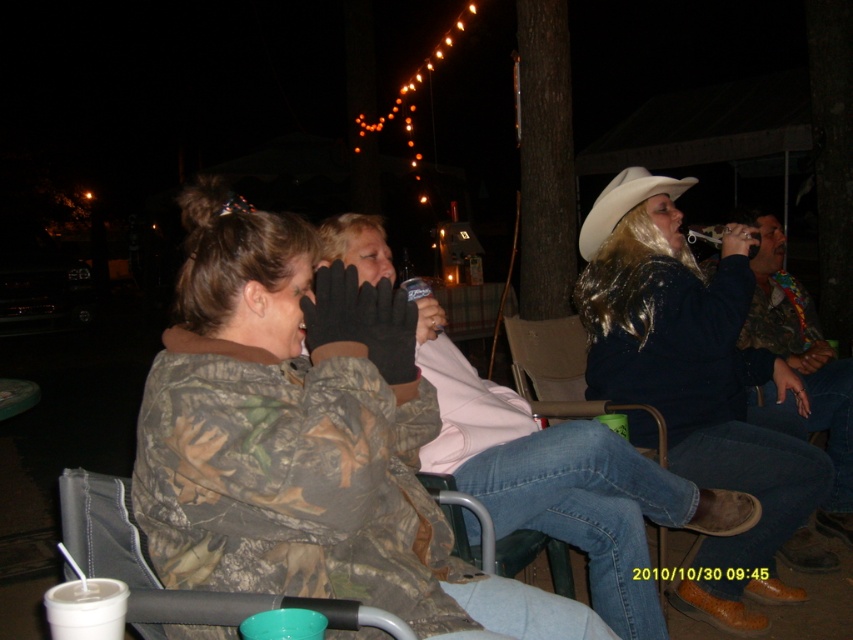
Is light pink fleece jacket at center positioned behind white styrofoam cup at lower left?

Yes.

Who is more distant from viewer, (383, 252) or (90, 604)?

Positioned behind is point (383, 252).

This screenshot has width=853, height=640. What are the coordinates of `light pink fleece jacket at center` in the screenshot? It's located at coord(561,480).

Measure the distance from camouflage jacket at center to white styrofoam cup at lower left.

They are 7.26 feet apart.

How distant is camouflage jacket at center from white styrofoam cup at lower left?

A distance of 7.26 feet exists between camouflage jacket at center and white styrofoam cup at lower left.

Which is in front, point (619, 228) or point (45, 609)?

Point (45, 609) is more forward.

The image size is (853, 640). What are the coordinates of `camouflage jacket at center` in the screenshot? It's located at (695, 381).

Is white styrofoam cup at lower left bigger than white matte cowboy hat at upper right?

No.

Can you confirm if white styrofoam cup at lower left is positioned to the left of white matte cowboy hat at upper right?

Indeed, white styrofoam cup at lower left is positioned on the left side of white matte cowboy hat at upper right.

Where is `white styrofoam cup at lower left`? white styrofoam cup at lower left is located at coordinates (86, 609).